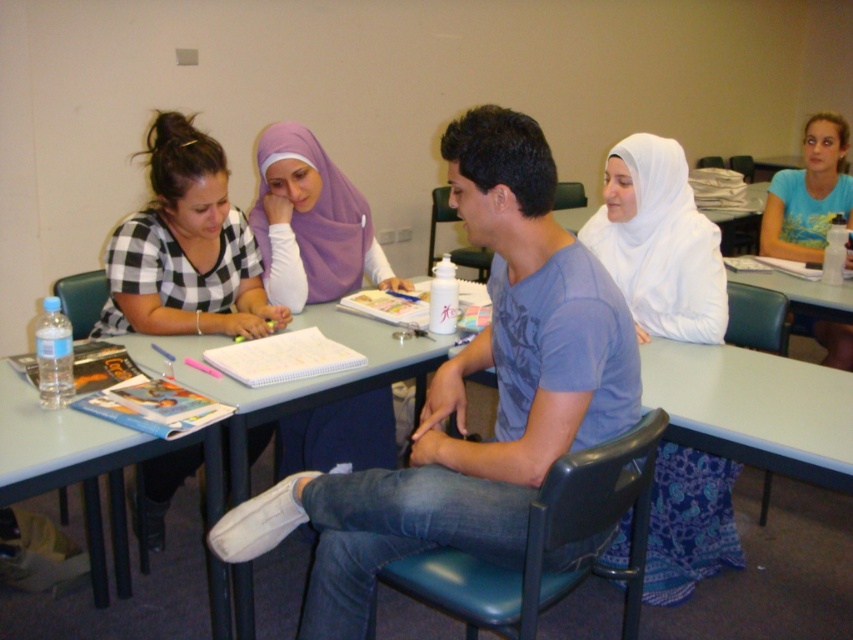
In the classroom scene, there is a purple fabric hijab at upper center and a blue cotton shirt at upper right. Which of these two items is smaller in size?

The purple fabric hijab at upper center is smaller than the blue cotton shirt at upper right according to the description.